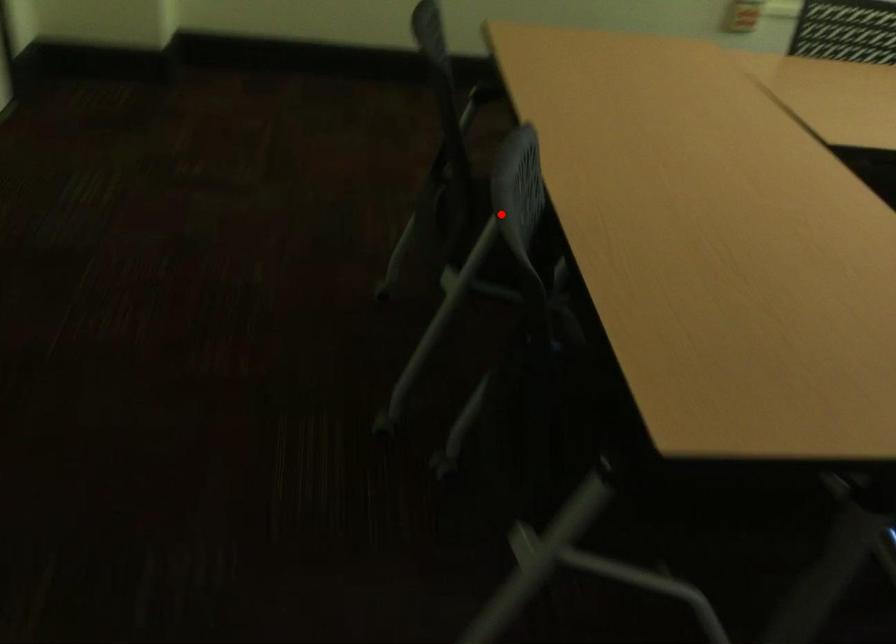
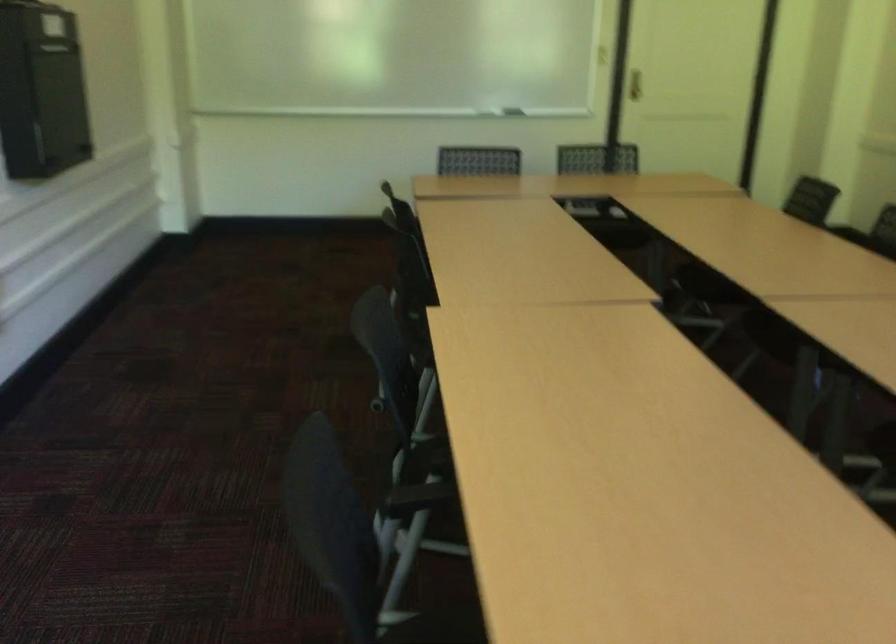
Question: I am providing you with two images of the same scene from different viewpoints. A red point is marked on the first image. Is the red point's position out of view in image 2?

Choices:
 (A) Yes
 (B) No

Answer: (A)